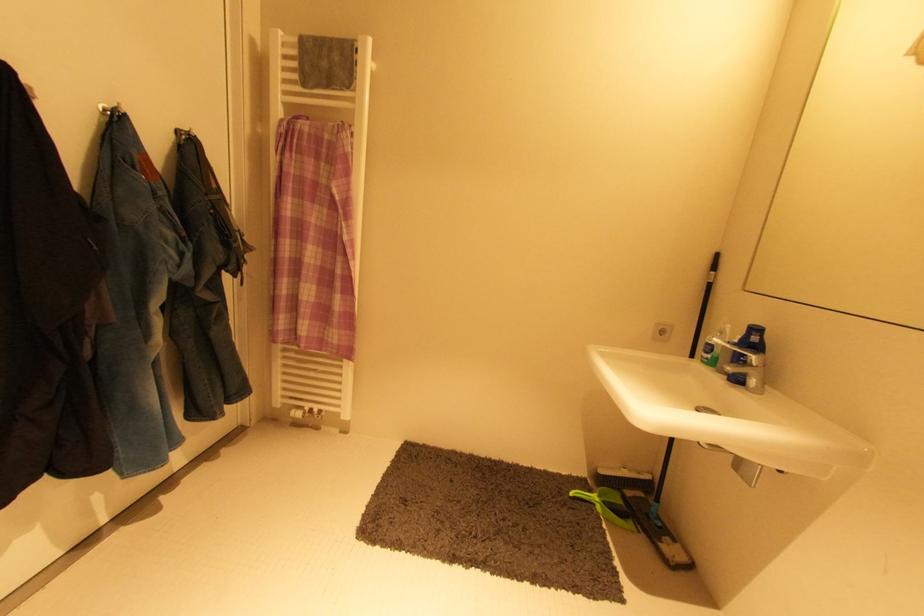
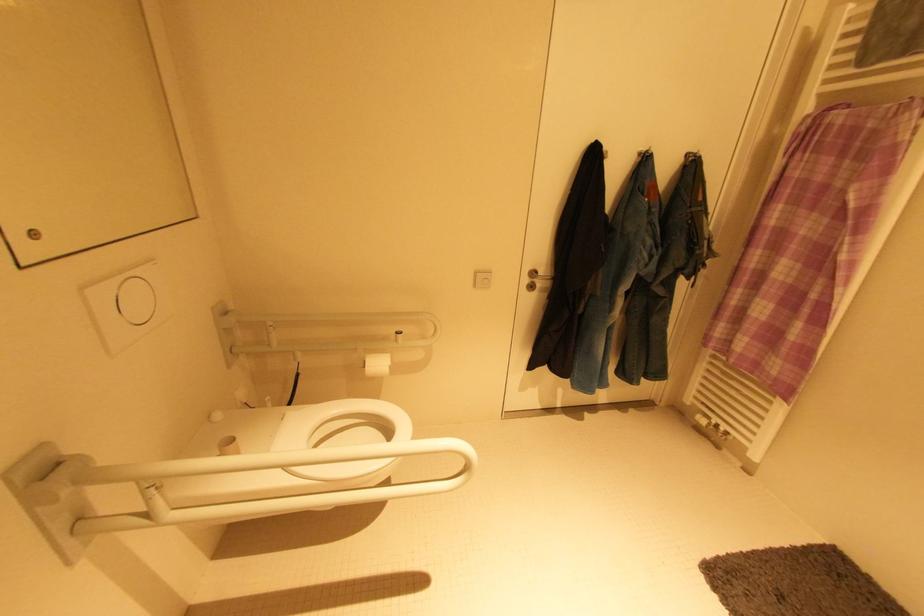
Question: The camera is either moving clockwise (left) or counter-clockwise (right) around the object. The first image is from the beginning of the video and the second image is from the end. Is the camera moving left or right when shooting the video?

Choices:
 (A) Left
 (B) Right

Answer: (B)